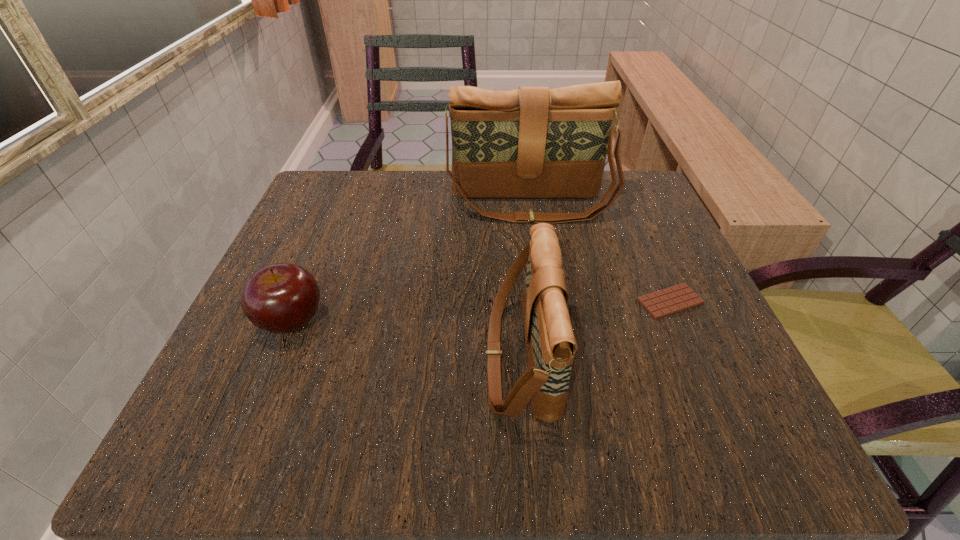
Locate an element on the screen. vacant space at the left edge of the desktop is located at coordinates (317, 389).

In the image, there is a desktop. Identify the location of free region at the right edge. This screenshot has height=540, width=960. tap(681, 317).

This screenshot has width=960, height=540. In the image, there is a desktop. In order to click on vacant space at the far left corner in this screenshot , I will do `click(381, 177)`.

You are a GUI agent. You are given a task and a screenshot of the screen. Output one action in this format:
    pyautogui.click(x=<x>, y=<y>)
    Task: Click on the free space at the far right corner of the desktop
    The height and width of the screenshot is (540, 960).
    Given the screenshot: What is the action you would take?
    pyautogui.click(x=606, y=178)

In the image, there is a desktop. Where is `vacant space at the near right corner`? The height and width of the screenshot is (540, 960). vacant space at the near right corner is located at coordinates (751, 417).

Locate an element on the screen. This screenshot has height=540, width=960. unoccupied area between the candy bar and the apple is located at coordinates coord(481,312).

Find the location of `vacant region between the apple and the shortest object`. vacant region between the apple and the shortest object is located at coordinates (481, 312).

Where is `vacant area that lies between the third tallest object and the candy bar`? The width and height of the screenshot is (960, 540). vacant area that lies between the third tallest object and the candy bar is located at coordinates (481, 312).

Identify the location of free space that is in between the nearer shoulder bag and the apple. (407, 340).

Find the location of a particular element. vacant space that's between the shorter shoulder bag and the shortest object is located at coordinates (595, 330).